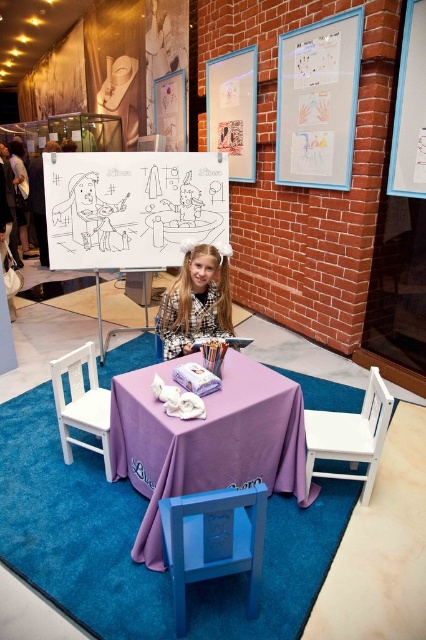
Question: Based on their relative distances, which object is farther from the purple fabric tablecloth at center?

Choices:
 (A) white wood chair at lower right
 (B) white wood chair at lower left

Answer: (B)

Question: Is smooth blue chair at lower center closer to the viewer compared to white wood chair at lower left?

Choices:
 (A) no
 (B) yes

Answer: (B)

Question: Which point is closer to the camera?

Choices:
 (A) blonde hair at center
 (B) white wood chair at lower left

Answer: (B)

Question: Does blonde hair at center lie behind white wood chair at lower left?

Choices:
 (A) no
 (B) yes

Answer: (B)

Question: Observing the image, what is the correct spatial positioning of purple fabric tablecloth at center in reference to white wood chair at lower left?

Choices:
 (A) right
 (B) left

Answer: (A)

Question: Which object is the farthest from the white wood chair at lower left?

Choices:
 (A) white wood chair at lower right
 (B) purple fabric tablecloth at center

Answer: (A)